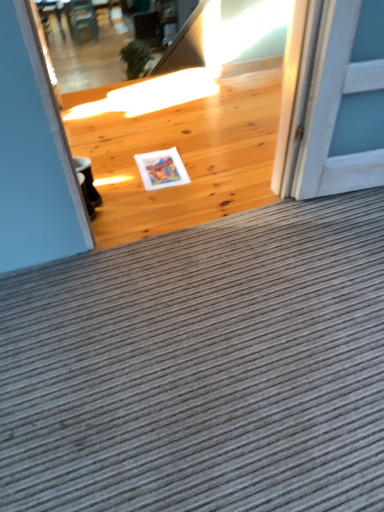
Question: Based on their sizes in the image, would you say gray corduroy doormat at center is bigger or smaller than natural wood floor at center?

Choices:
 (A) small
 (B) big

Answer: (B)

Question: In terms of height, does gray corduroy doormat at center look taller or shorter compared to natural wood floor at center?

Choices:
 (A) short
 (B) tall

Answer: (A)

Question: Which object is positioned farthest from the gray corduroy doormat at center?

Choices:
 (A) wooden chair at upper left
 (B) natural wood floor at center
 (C) white matte postcard at center

Answer: (A)

Question: Which of these objects is positioned closest to the natural wood floor at center?

Choices:
 (A) white matte postcard at center
 (B) wooden chair at upper left
 (C) gray corduroy doormat at center

Answer: (A)